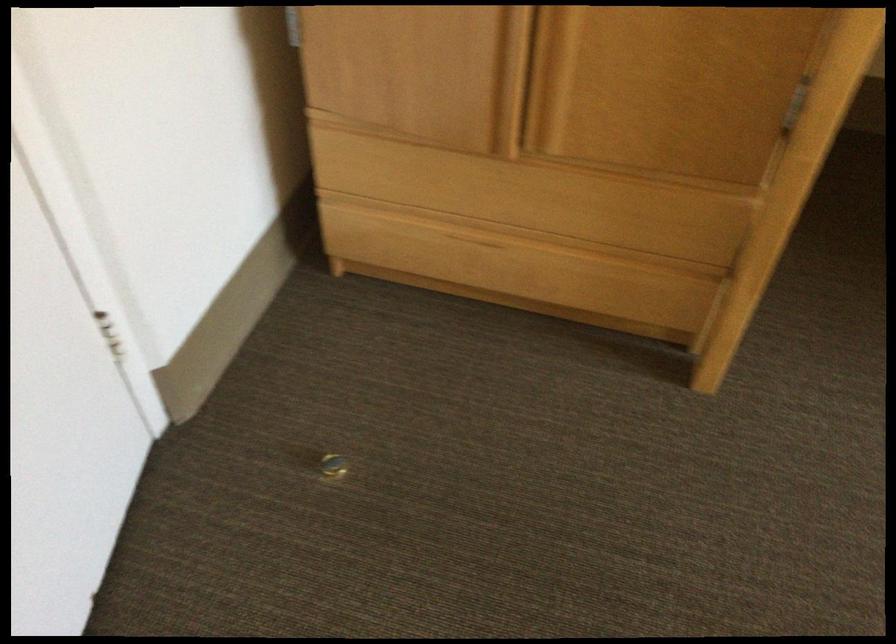
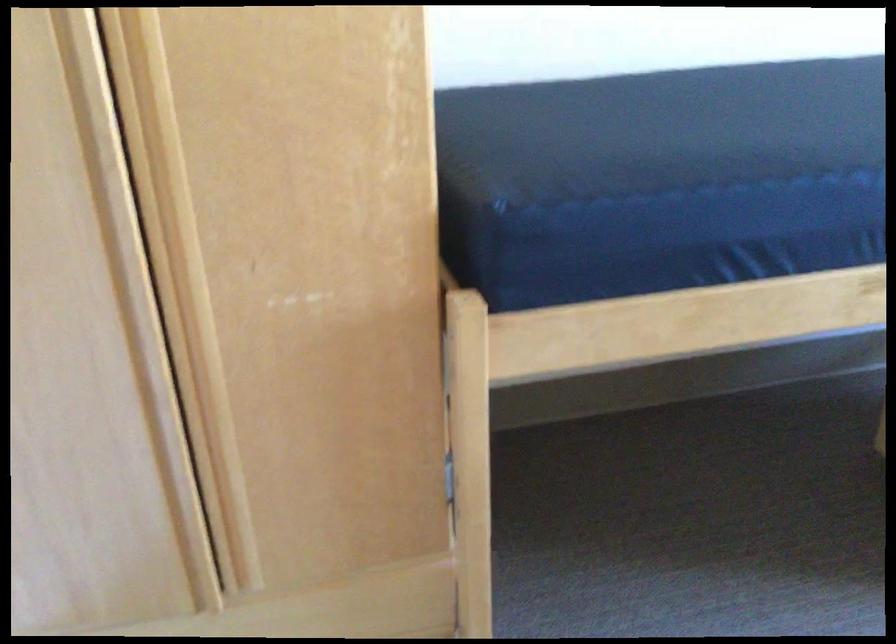
The images are taken continuously from a first-person perspective. In which direction is your viewpoint rotating?

The camera's rotation is toward right-up.